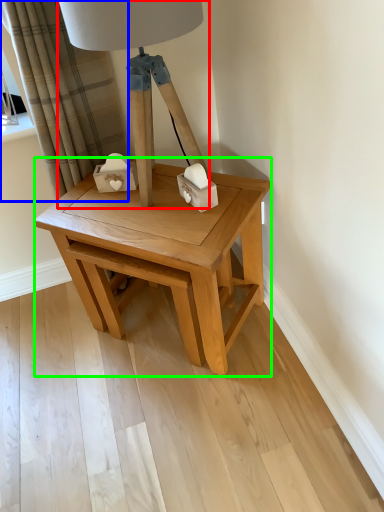
Question: Which is nearer to the table lamp (highlighted by a red box)? curtain (highlighted by a blue box) or table (highlighted by a green box).

Choices:
 (A) curtain
 (B) table

Answer: (B)